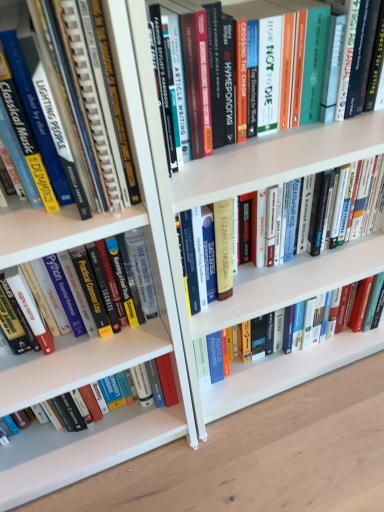
Question: Is hardcover book at center, marked as the fourth book in a bottom-to-top arrangement, bigger than hardcover book at lower left, the 1th book from the bottom?

Choices:
 (A) yes
 (B) no

Answer: (A)

Question: Is hardcover book at center, marked as the fourth book in a bottom-to-top arrangement, positioned far away from hardcover book at lower left, the fifth book viewed from the top?

Choices:
 (A) yes
 (B) no

Answer: (B)

Question: Is hardcover book at center, marked as the fourth book in a bottom-to-top arrangement, surrounding hardcover book at lower left, the 1th book from the bottom?

Choices:
 (A) no
 (B) yes

Answer: (A)

Question: Is hardcover book at center, positioned as the second book in top-to-bottom order, touching hardcover book at lower left, the fifth book viewed from the top?

Choices:
 (A) yes
 (B) no

Answer: (B)

Question: Does hardcover book at center, positioned as the second book in top-to-bottom order, lie behind hardcover book at lower left, the fifth book viewed from the top?

Choices:
 (A) yes
 (B) no

Answer: (B)

Question: Based on their sizes in the image, would you say hardcover book at center, marked as the fourth book in a bottom-to-top arrangement, is bigger or smaller than hardcover book at center, which ranks as the fourth book in top-to-bottom order?

Choices:
 (A) big
 (B) small

Answer: (A)

Question: In terms of width, does hardcover book at center, marked as the fourth book in a bottom-to-top arrangement, look wider or thinner when compared to hardcover book at center, the 2th book positioned from the bottom?

Choices:
 (A) wide
 (B) thin

Answer: (A)

Question: From the image's perspective, is hardcover book at center, positioned as the second book in top-to-bottom order, above or below hardcover book at center, which ranks as the fourth book in top-to-bottom order?

Choices:
 (A) below
 (B) above

Answer: (B)

Question: Does point click(231, 194) appear closer or farther from the camera than point click(263, 271)?

Choices:
 (A) farther
 (B) closer

Answer: (B)

Question: Considering the positions of point (327, 262) and point (13, 268), is point (327, 262) closer or farther from the camera than point (13, 268)?

Choices:
 (A) closer
 (B) farther

Answer: (B)

Question: From a real-world perspective, is hardcover book at center, the 2th book positioned from the bottom, positioned above or below hardcover book at left, the 3th book ordered from the bottom?

Choices:
 (A) above
 (B) below

Answer: (B)

Question: From the image's perspective, is hardcover book at center, the 2th book positioned from the bottom, positioned above or below hardcover book at left, which ranks as the 3th book in top-to-bottom order?

Choices:
 (A) above
 (B) below

Answer: (B)

Question: Considering the relative positions of hardcover book at center, which ranks as the fourth book in top-to-bottom order, and hardcover book at left, the 3th book ordered from the bottom, in the image provided, is hardcover book at center, which ranks as the fourth book in top-to-bottom order, to the left or to the right of hardcover book at left, the 3th book ordered from the bottom,?

Choices:
 (A) right
 (B) left

Answer: (A)

Question: Relative to hardcover book at center, the fifth book when ordered from bottom to top, is hardcover book at center, positioned as the second book in top-to-bottom order, in front or behind?

Choices:
 (A) front
 (B) behind

Answer: (B)

Question: In terms of height, does hardcover book at center, positioned as the second book in top-to-bottom order, look taller or shorter compared to hardcover book at center, acting as the 1th book starting from the top?

Choices:
 (A) short
 (B) tall

Answer: (A)